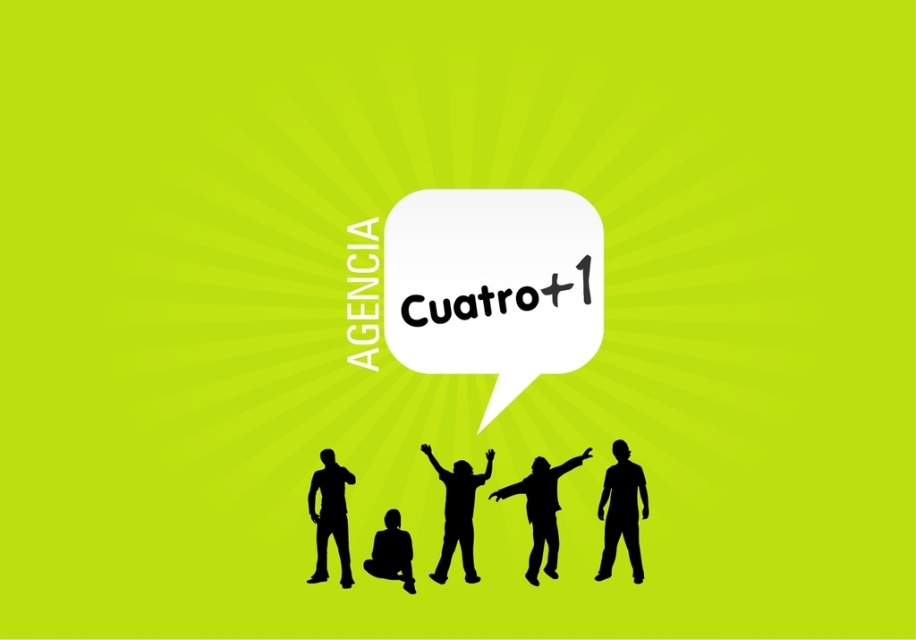
Question: Does black matte figure at center appear on the left side of black matte person at center?

Choices:
 (A) yes
 (B) no

Answer: (B)

Question: Which point is closer to the camera?

Choices:
 (A) yellow text at upper center
 (B) black silhouette at lower left
 (C) black matte figure at center
 (D) black matte person at center

Answer: (B)

Question: Where is black silhouette figure at lower right located in relation to yellow text at upper center in the image?

Choices:
 (A) left
 (B) right

Answer: (B)

Question: Considering the real-world distances, which object is farthest from the black matte figure at lower center?

Choices:
 (A) yellow text at upper center
 (B) black matte figure at center
 (C) black silhouette figure at lower right

Answer: (C)

Question: Among these objects, which one is nearest to the camera?

Choices:
 (A) yellow text at upper center
 (B) black matte figure at lower center
 (C) black matte person at center

Answer: (B)

Question: Does black matte person at center appear over black matte figure at lower center?

Choices:
 (A) yes
 (B) no

Answer: (A)